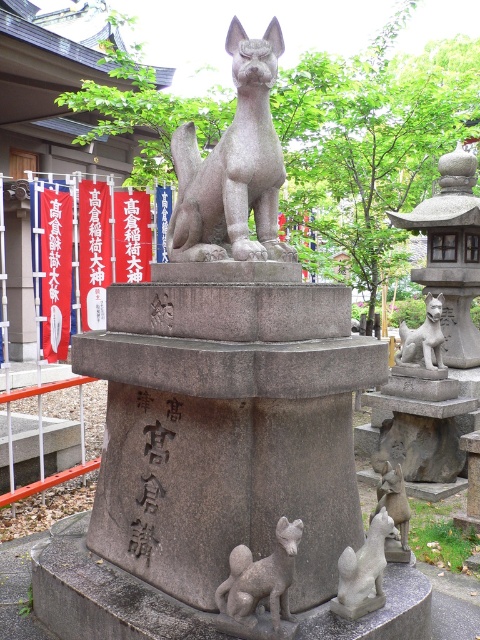
Question: In this image, where is stone lantern at center located relative to gray stone fox at lower center?

Choices:
 (A) left
 (B) right

Answer: (B)

Question: Which point appears closest to the camera in this image?

Choices:
 (A) (404, 339)
 (B) (367, 570)
 (C) (187, 132)

Answer: (B)

Question: Considering the real-world distances, which object is farthest from the stone lantern at center?

Choices:
 (A) gray stone fox at center
 (B) gray stone fox at lower center

Answer: (B)

Question: Is gray stone pedestal at center above stone lantern at center?

Choices:
 (A) no
 (B) yes

Answer: (A)

Question: Can you confirm if gray stone fox at lower center is positioned to the left of gray stone fox at lower right?

Choices:
 (A) yes
 (B) no

Answer: (A)

Question: Which object is the closest to the gray stone fox at lower center?

Choices:
 (A) gray stone fox at lower right
 (B) stone lantern at center
 (C) gray stone pedestal at center

Answer: (A)